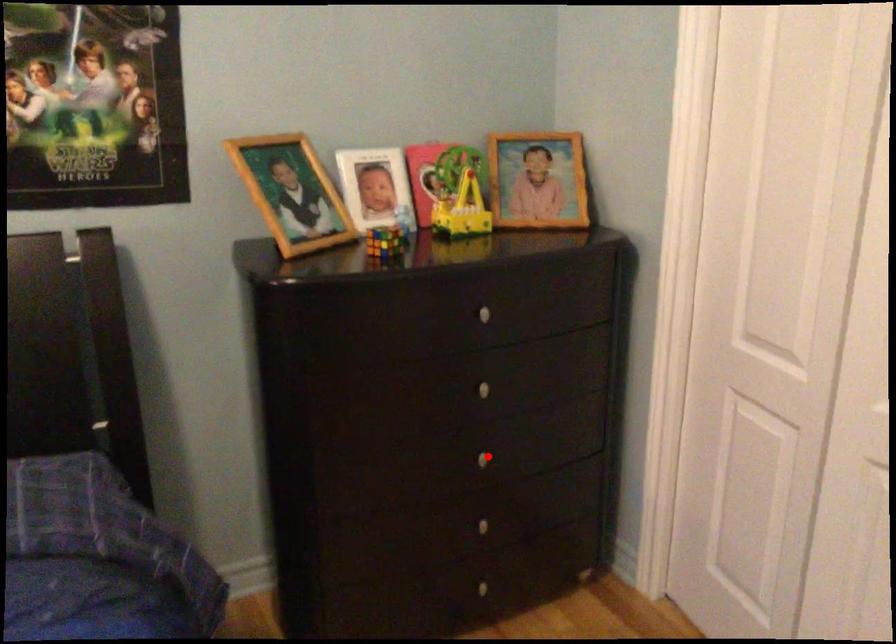
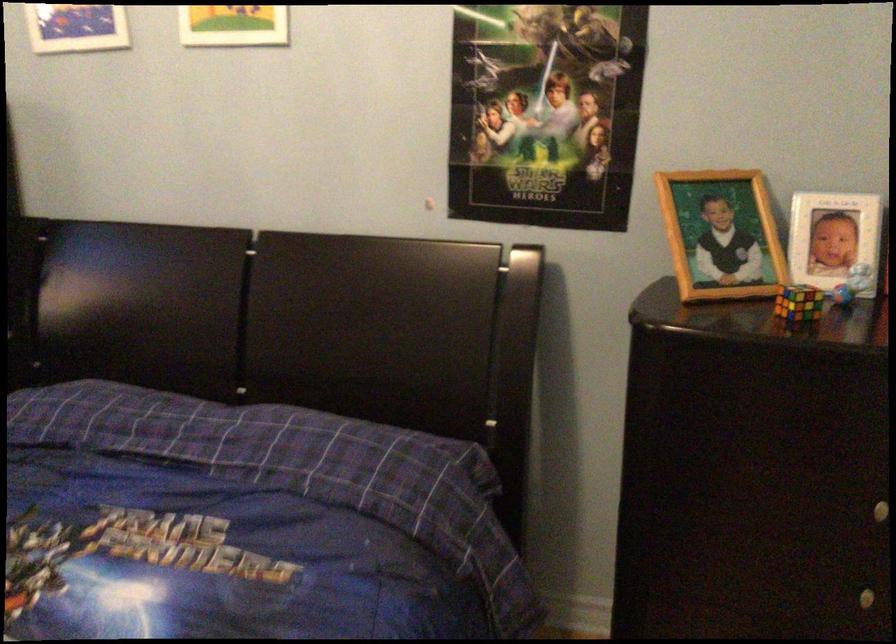
Where in the second image is the point corresponding to the highlighted location from the first image?

(868, 597)